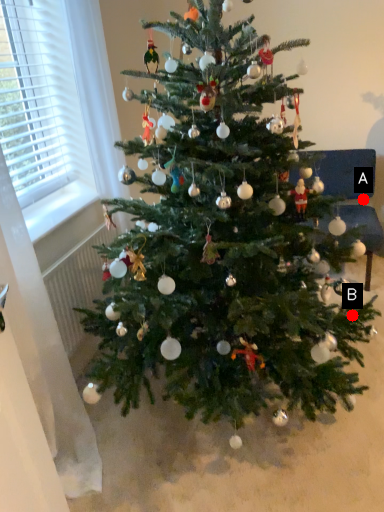
Question: Two points are circled on the image, labeled by A and B beside each circle. Which point is farther from the camera taking this photo?

Choices:
 (A) A is further
 (B) B is further

Answer: (A)